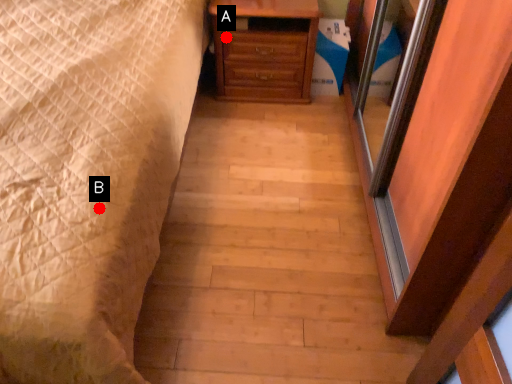
Question: Two points are circled on the image, labeled by A and B beside each circle. Among these points, which one is nearest to the camera?

Choices:
 (A) A is closer
 (B) B is closer

Answer: (B)